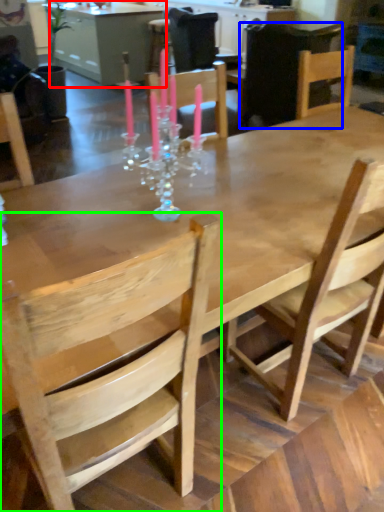
Question: Which is farther away from table (highlighted by a red box)? chair (highlighted by a blue box) or chair (highlighted by a green box)?

Choices:
 (A) chair
 (B) chair

Answer: (B)